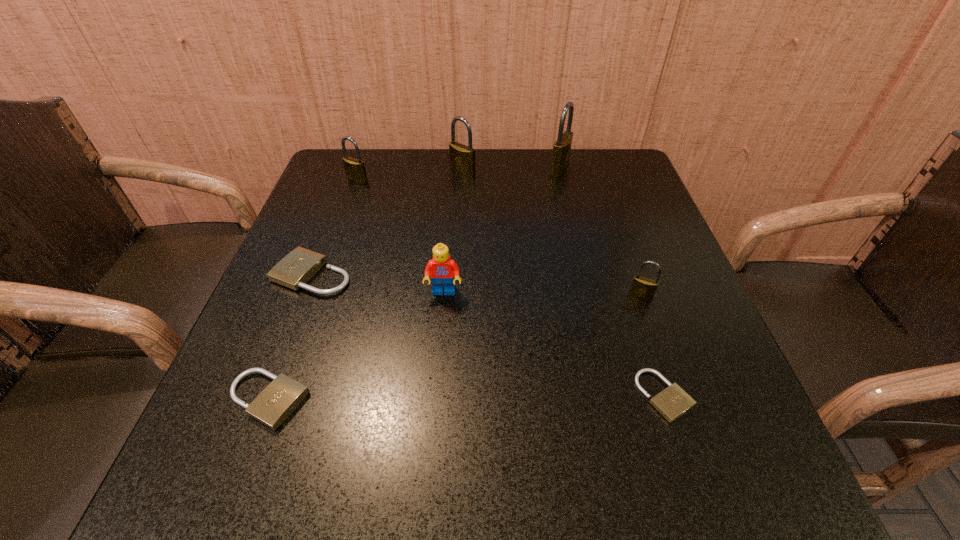
I want to click on blank region between the rightmost beige padlock and the leftmost brass padlock, so [x=511, y=288].

Where is `vacant region between the rightmost beige padlock and the farthest beige padlock`? The height and width of the screenshot is (540, 960). vacant region between the rightmost beige padlock and the farthest beige padlock is located at coordinates (489, 335).

At what (x,y) coordinates should I click in order to perform the action: click on blank region between the leftmost brass padlock and the third shortest object. Please return your answer as a coordinate pair (x, y). Image resolution: width=960 pixels, height=540 pixels. Looking at the image, I should click on (335, 227).

In order to click on blank region between the nearest brass padlock and the seventh shortest object in this screenshot , I will do `click(552, 233)`.

Locate an element on the screen. The image size is (960, 540). blank region between the second shortest object and the rightmost beige padlock is located at coordinates (467, 398).

This screenshot has width=960, height=540. Identify the location of empty space between the fourth shortest padlock and the Lego. (542, 294).

What are the coordinates of `unoccupied position between the third padlock from right to left and the second smallest brass padlock` in the screenshot? It's located at (459, 174).

This screenshot has width=960, height=540. I want to click on vacant area between the leftmost brass padlock and the Lego, so click(400, 236).

This screenshot has height=540, width=960. I want to click on the second closest object relative to the seventh shortest object, so click(355, 170).

Select which object is the third closest to the Lego. Please provide its 2D coordinates. Your answer should be formatted as a tuple, i.e. [(x, y)], where the tuple contains the x and y coordinates of a point satisfying the conditions above.

[(644, 288)]